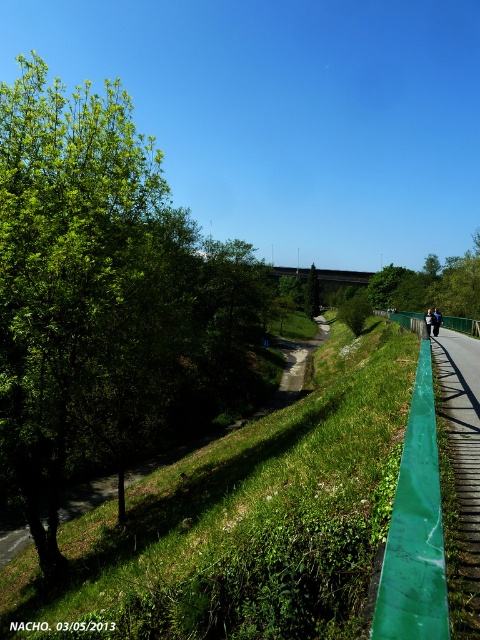
Question: Does green leafy tree at left have a greater width compared to green leafy tree at center?

Choices:
 (A) no
 (B) yes

Answer: (B)

Question: Does green leafy tree at center appear on the right side of dark blue jacket at center?

Choices:
 (A) no
 (B) yes

Answer: (A)

Question: Considering the real-world distances, which object is farthest from the green leafy tree at left?

Choices:
 (A) green leafy tree at center
 (B) dark blue jacket at center

Answer: (A)

Question: Can you confirm if green leafy tree at left is wider than dark blue jacket at center?

Choices:
 (A) no
 (B) yes

Answer: (B)

Question: Considering the real-world distances, which object is farthest from the green leafy tree at center?

Choices:
 (A) green leafy tree at left
 (B) dark blue jacket at center

Answer: (B)

Question: Which point is farther to the camera?

Choices:
 (A) (312, 284)
 (B) (430, 317)
 (C) (6, 486)

Answer: (A)